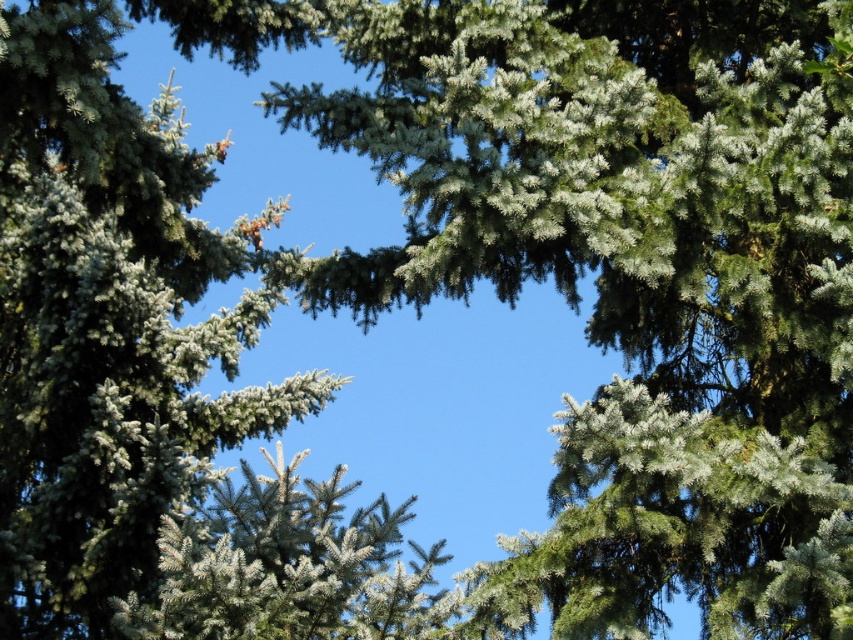
Can you confirm if green needle-like at upper left is positioned to the left of green needle-like at center?

Indeed, green needle-like at upper left is positioned on the left side of green needle-like at center.

Is green needle-like at upper left to the right of green needle-like at center from the viewer's perspective?

In fact, green needle-like at upper left is to the left of green needle-like at center.

Is point (122, 419) positioned after point (230, 612)?

That is True.

This screenshot has height=640, width=853. What are the coordinates of `green needle-like at upper left` in the screenshot? It's located at (107, 323).